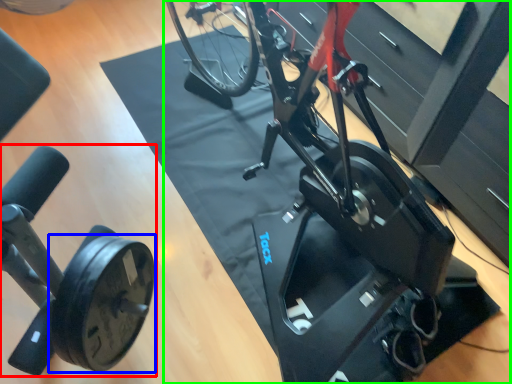
Question: Considering the real-world distances, which object is closest to stationary bicycle (highlighted by a red box)? wheel (highlighted by a blue box) or stationary bicycle (highlighted by a green box).

Choices:
 (A) wheel
 (B) stationary bicycle

Answer: (A)